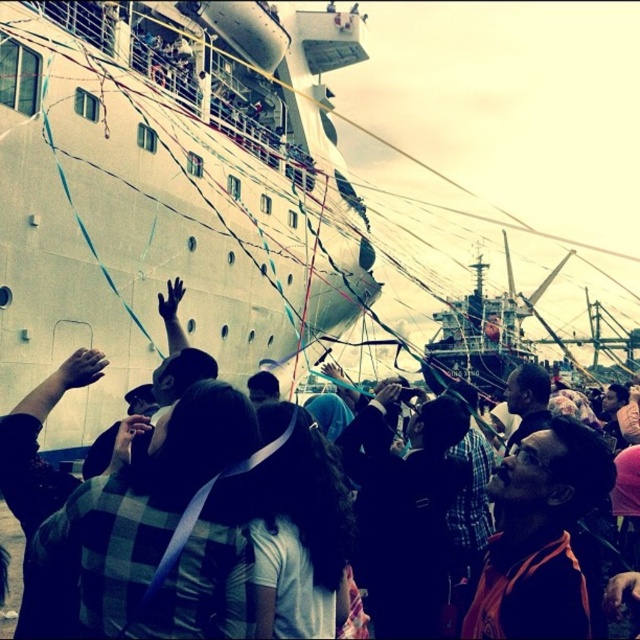
Who is positioned more to the left, white matte ship at upper left or black fabric crowd at lower center?

white matte ship at upper left is more to the left.

Is white matte ship at upper left in front of black fabric crowd at lower center?

No, white matte ship at upper left is further to the viewer.

Image resolution: width=640 pixels, height=640 pixels. What do you see at coordinates (170, 188) in the screenshot?
I see `white matte ship at upper left` at bounding box center [170, 188].

This screenshot has height=640, width=640. Find the location of `white matte ship at upper left`. white matte ship at upper left is located at coordinates (170, 188).